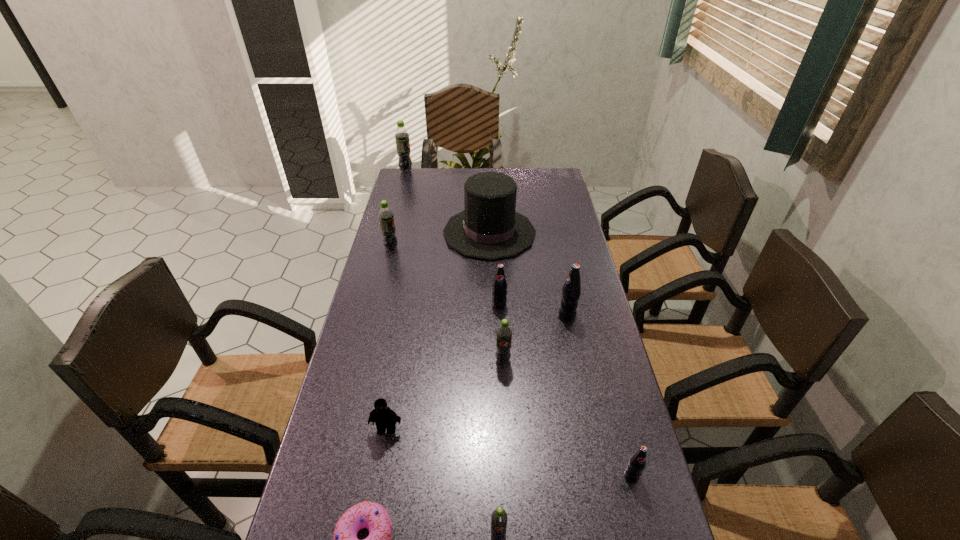
The width and height of the screenshot is (960, 540). What are the coordinates of `object that ranks as the second closest to the ninth object from left to right` in the screenshot? It's located at (504, 333).

Choose which soda is the second nearest neighbor to the biggest green soda. Please provide its 2D coordinates. Your answer should be formatted as a tuple, i.e. [(x, y)], where the tuple contains the x and y coordinates of a point satisfying the conditions above.

[(499, 299)]

In order to click on soda that is the sixth nearest to the farthest object in this screenshot , I will do `click(499, 517)`.

The height and width of the screenshot is (540, 960). Find the location of `green soda that is the second closest to the sixth soda from left to right`. green soda that is the second closest to the sixth soda from left to right is located at coordinates (499, 517).

Locate an element on the screen. The image size is (960, 540). green soda object that ranks as the closest to the second nearest green soda is located at coordinates (499, 517).

Locate an element on the screen. This screenshot has width=960, height=540. the closest black pop relative to the third nearest object is located at coordinates (571, 290).

Point out which black pop is positioned as the second nearest to the sixth farthest soda. Please provide its 2D coordinates. Your answer should be formatted as a tuple, i.e. [(x, y)], where the tuple contains the x and y coordinates of a point satisfying the conditions above.

[(499, 299)]